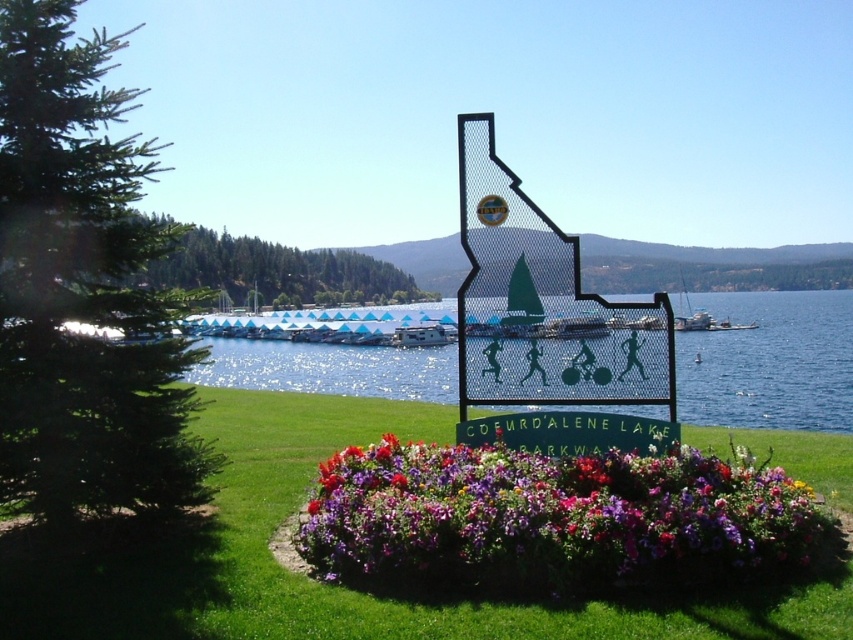
You are a landscape architect planning to install a new pathway between the vibrant multicolored petals at center and the metallic silver boat at center. What is the minimum width required for the pathway to accommodate both a 5 meter wide flower bed and a 3 meter wide walkway?

The minimum width required for the pathway between the vibrant multicolored petals at center and the metallic silver boat at center is 8 meters, as the flower bed requires 5 meters and the walkway needs 3 meters, totaling 8 meters.

You are a photographer trying to capture a photo of the vibrant multicolored petals at center and the metallic silver boat at center. Which object should you focus on first if you want to include both in your shot without moving the camera?

The vibrant multicolored petals at center should be focused on first because it is larger than the metallic silver boat at center, allowing it to be more prominent in the frame while still including the boat.

You are standing at the point with coordinates point (x=445, y=333) and want to walk to the point with coordinates point (x=741, y=452). Which direction should you walk to reach your destination?

You should walk forward because point (x=741, y=452) is in front of point (x=445, y=333).